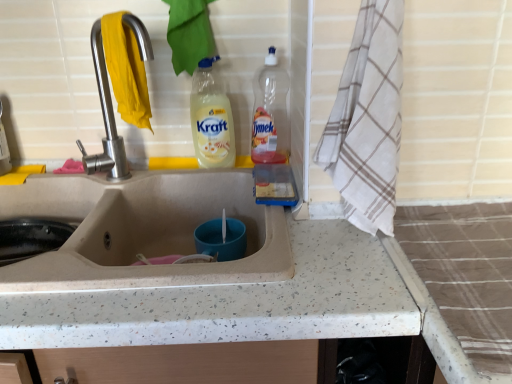
Question: Is white checkered towel at right taller or shorter than beige speckled sink at center?

Choices:
 (A) short
 (B) tall

Answer: (B)

Question: Is white checkered towel at right to the left or to the right of beige speckled sink at center in the image?

Choices:
 (A) left
 (B) right

Answer: (B)

Question: Based on their relative distances, which object is farther from the yellow translucent bottle at upper center, the second bottle in the right-to-left sequence?

Choices:
 (A) translucent plastic bottle at upper right, which ranks as the 2th bottle in left-to-right order
 (B) speckled stone countertop at center
 (C) beige speckled sink at center
 (D) satin nickel faucet at upper left
 (E) white checkered towel at right

Answer: (B)

Question: Considering the real-world distances, which object is closest to the satin nickel faucet at upper left?

Choices:
 (A) beige speckled sink at center
 (B) yellow translucent bottle at upper center, the second bottle in the right-to-left sequence
 (C) speckled stone countertop at center
 (D) translucent plastic bottle at upper right, which ranks as the 2th bottle in left-to-right order
 (E) white checkered towel at right

Answer: (B)